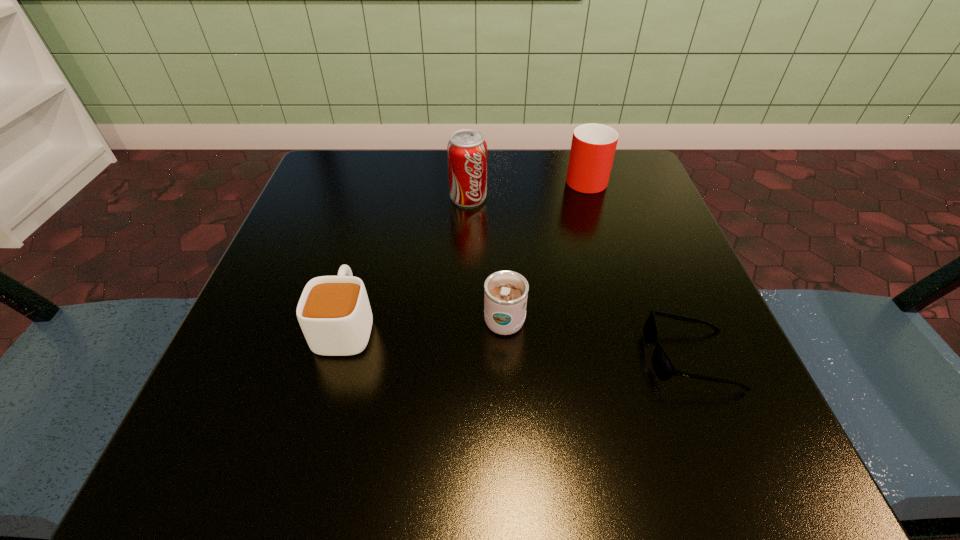
At what (x,y) coordinates should I click in order to perform the action: click on sunglasses situated at the right edge. Please return your answer as a coordinate pair (x, y). Looking at the image, I should click on (662, 365).

The width and height of the screenshot is (960, 540). Find the location of `object that is at the far right corner`. object that is at the far right corner is located at coordinates (593, 147).

Locate an element on the screen. The height and width of the screenshot is (540, 960). vacant area at the far edge is located at coordinates (543, 199).

Where is `vacant area at the near edge of the desktop`? vacant area at the near edge of the desktop is located at coordinates (481, 436).

You are a GUI agent. You are given a task and a screenshot of the screen. Output one action in this format:
    pyautogui.click(x=<x>, y=<y>)
    Task: Click on the free region at the left edge
    The width and height of the screenshot is (960, 540).
    Given the screenshot: What is the action you would take?
    tap(312, 217)

You are a GUI agent. You are given a task and a screenshot of the screen. Output one action in this format:
    pyautogui.click(x=<x>, y=<y>)
    Task: Click on the free space at the right edge of the desktop
    
    Given the screenshot: What is the action you would take?
    pyautogui.click(x=612, y=265)

I want to click on vacant space at the far left corner, so click(353, 156).

Locate an element on the screen. This screenshot has width=960, height=540. vacant space at the far right corner is located at coordinates (580, 196).

This screenshot has height=540, width=960. I want to click on free location at the near right corner of the desktop, so click(755, 433).

Locate an element on the screen. The width and height of the screenshot is (960, 540). vacant space that is in between the second shortest object and the second cup from right to left is located at coordinates (425, 321).